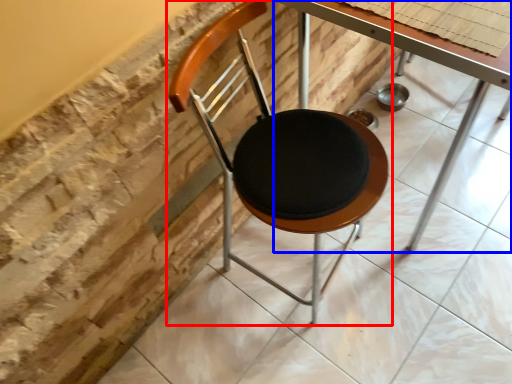
Question: Which point is closer to the camera, chair (highlighted by a red box) or table (highlighted by a blue box)?

Choices:
 (A) chair
 (B) table

Answer: (A)